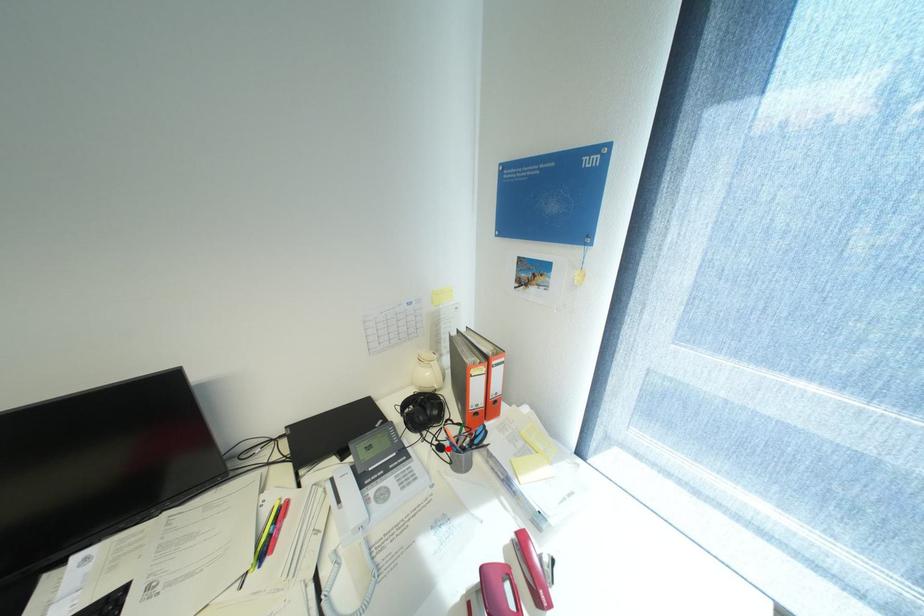
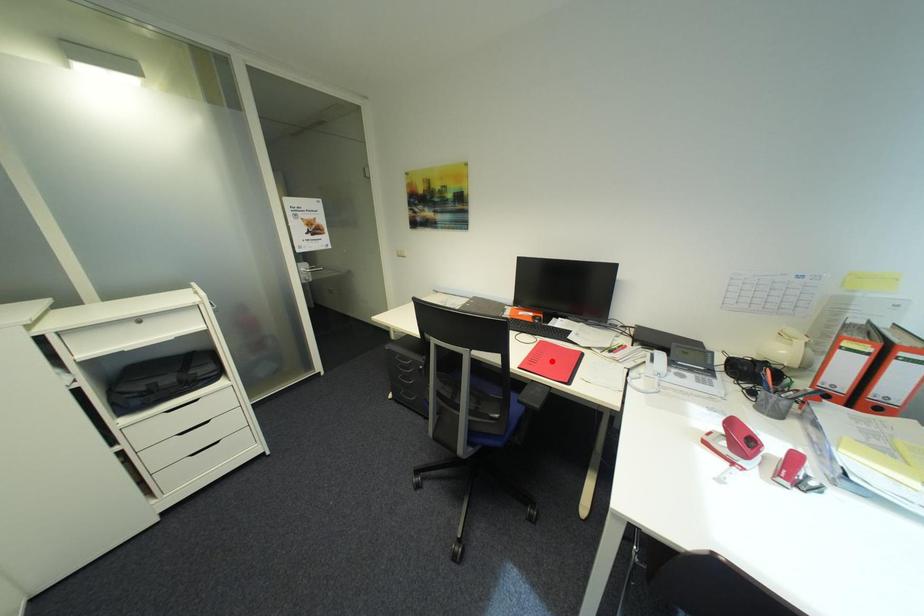
I am providing you with two images of the same scene from different viewpoints. A red point is marked on the first image and another point is marked on the second image. Do the highlighted points in image1 and image2 indicate the same real-world spot?

No